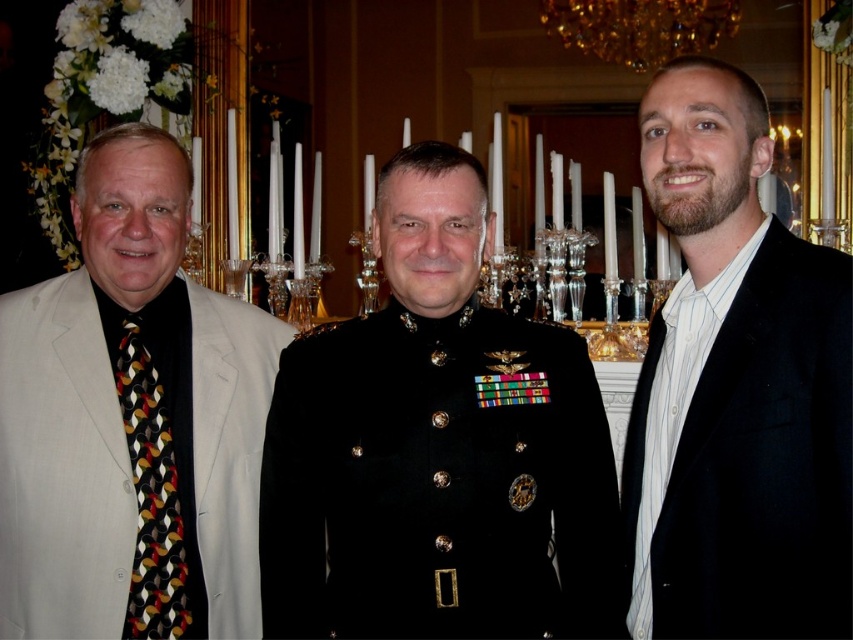
Question: Does black uniform at center appear on the right side of light beige suit at left?

Choices:
 (A) yes
 (B) no

Answer: (A)

Question: Which of the following is the closest to the observer?

Choices:
 (A) (155, 445)
 (B) (593, 484)
 (C) (107, 448)

Answer: (B)

Question: Is black uniform at center bigger than multicolored patterned tie at left?

Choices:
 (A) yes
 (B) no

Answer: (A)

Question: Among these objects, which one is nearest to the camera?

Choices:
 (A) light beige suit at left
 (B) multicolored patterned tie at left

Answer: (A)

Question: Is light beige suit at left positioned at the back of black velvet suit at right?

Choices:
 (A) no
 (B) yes

Answer: (B)

Question: Which point is closer to the camera?

Choices:
 (A) (189, 552)
 (B) (68, 381)

Answer: (B)